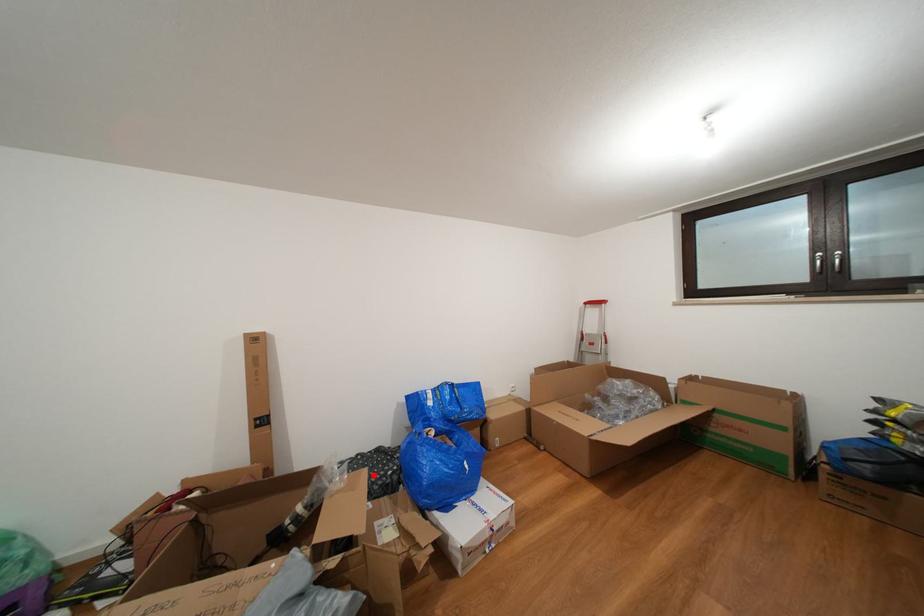
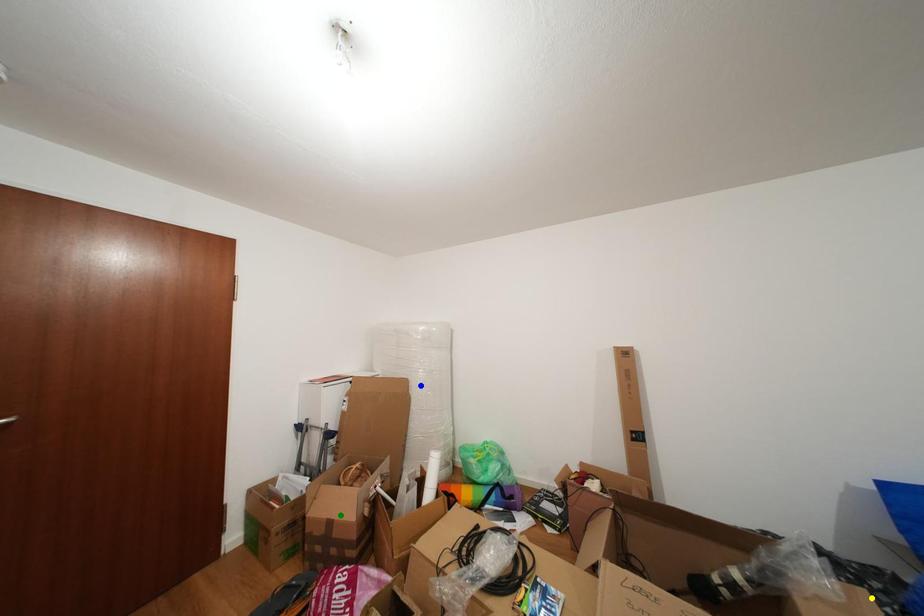
Question: I am providing you with two images of the same scene from different viewpoints. A red point is marked on the first image. You are given multiple points on the second image. Can you choose the point in image 2 that corresponds to the point in image 1?

Choices:
 (A) green point
 (B) yellow point
 (C) blue point

Answer: (B)